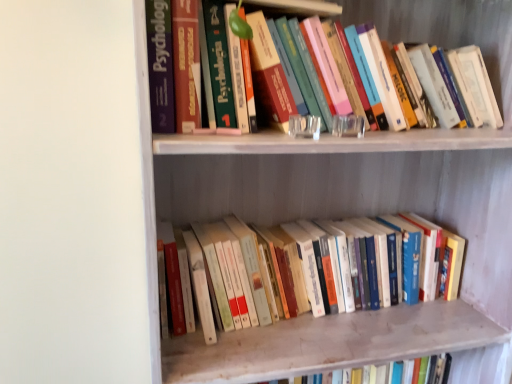
Question: Is wooden bookshelf at upper center wider than hardcover book at upper center, the 2th book from the bottom?

Choices:
 (A) no
 (B) yes

Answer: (B)

Question: Is hardcover book at upper center, the 2th book from the bottom, completely or partially inside wooden bookshelf at upper center?

Choices:
 (A) yes
 (B) no

Answer: (A)

Question: Does wooden bookshelf at upper center have a larger size compared to hardcover book at upper center, the 2th book from the bottom?

Choices:
 (A) yes
 (B) no

Answer: (A)

Question: Is wooden bookshelf at upper center smaller than hardcover book at upper center, the 2th book from the bottom?

Choices:
 (A) yes
 (B) no

Answer: (B)

Question: Is wooden bookshelf at upper center further to the viewer compared to hardcover book at upper center, which ranks as the 1th book in top-to-bottom order?

Choices:
 (A) no
 (B) yes

Answer: (A)

Question: From a real-world perspective, is wooden bookshelf at upper center below hardcover book at upper center, which ranks as the 1th book in top-to-bottom order?

Choices:
 (A) no
 (B) yes

Answer: (B)

Question: Can you confirm if hardcover books at lower center, arranged as the 1th book when ordered from the bottom, is smaller than hardcover book at upper center, which ranks as the 1th book in top-to-bottom order?

Choices:
 (A) no
 (B) yes

Answer: (B)

Question: Is hardcover book at upper center, which ranks as the 1th book in top-to-bottom order, completely or partially inside hardcover books at lower center, arranged as the 1th book when ordered from the bottom?

Choices:
 (A) no
 (B) yes

Answer: (A)

Question: Is hardcover books at lower center, arranged as the 1th book when ordered from the bottom, thinner than hardcover book at upper center, the 2th book from the bottom?

Choices:
 (A) no
 (B) yes

Answer: (B)

Question: From the image's perspective, would you say hardcover books at lower center, which is the second book from top to bottom, is shown under hardcover book at upper center, the 2th book from the bottom?

Choices:
 (A) yes
 (B) no

Answer: (A)

Question: Is hardcover books at lower center, arranged as the 1th book when ordered from the bottom, located outside hardcover book at upper center, which ranks as the 1th book in top-to-bottom order?

Choices:
 (A) no
 (B) yes

Answer: (B)

Question: Is the position of hardcover books at lower center, which is the second book from top to bottom, less distant than that of hardcover book at upper center, the 2th book from the bottom?

Choices:
 (A) no
 (B) yes

Answer: (A)

Question: Is hardcover book at upper center, the 2th book from the bottom, smaller than wooden bookshelf at upper center?

Choices:
 (A) no
 (B) yes

Answer: (B)